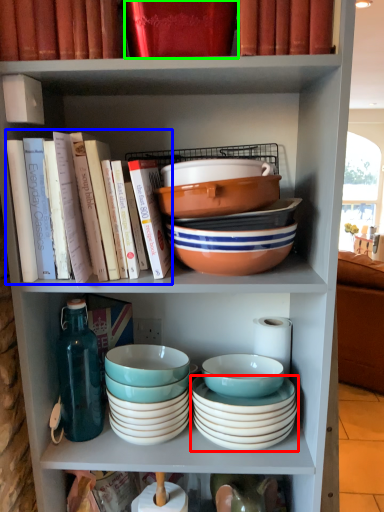
Question: Which object is positioned farthest from bowl (highlighted by a red box)? Select from book (highlighted by a blue box) and book (highlighted by a green box).

Choices:
 (A) book
 (B) book

Answer: (B)